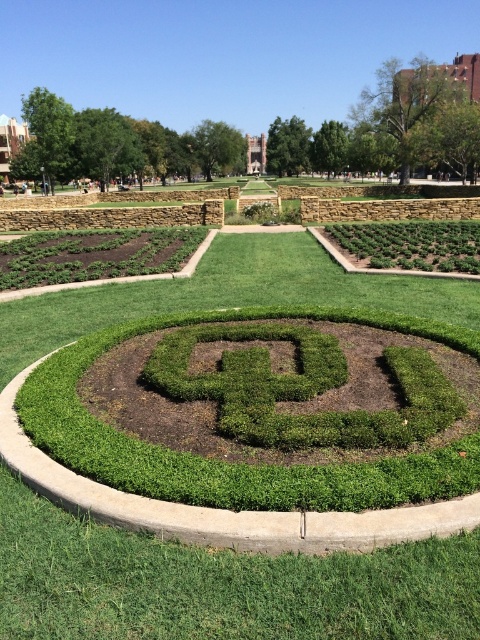
Is green grass at center smaller than green leafy hedge at right?

Incorrect, green grass at center is not smaller in size than green leafy hedge at right.

This screenshot has width=480, height=640. Describe the element at coordinates (218, 586) in the screenshot. I see `green grass at center` at that location.

Is point (422, 545) more distant than point (475, 236)?

That is False.

Find the location of a particular element. This screenshot has width=480, height=640. green grass at center is located at coordinates (218, 586).

In the scene shown: Does green grass at center have a smaller size compared to green shrubbery at lower left?

No.

Which is more to the right, green grass at center or green shrubbery at lower left?

Positioned to the right is green grass at center.

The height and width of the screenshot is (640, 480). Describe the element at coordinates (218, 586) in the screenshot. I see `green grass at center` at that location.

Where is `green grass at center`? The height and width of the screenshot is (640, 480). green grass at center is located at coordinates (218, 586).

Is point (171, 262) farther from camera compared to point (419, 268)?

Yes, point (171, 262) is behind point (419, 268).

Who is more distant from viewer, (x=148, y=268) or (x=411, y=262)?

Positioned behind is point (x=148, y=268).

Locate an element on the screen. This screenshot has width=480, height=640. green shrubbery at lower left is located at coordinates (92, 256).